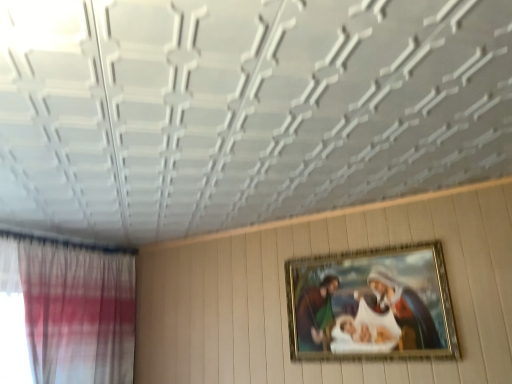
This screenshot has height=384, width=512. What do you see at coordinates (371, 304) in the screenshot?
I see `gold-framed painting at center` at bounding box center [371, 304].

Where is `gold-framed painting at center`? The width and height of the screenshot is (512, 384). gold-framed painting at center is located at coordinates (371, 304).

You are a GUI agent. You are given a task and a screenshot of the screen. Output one action in this format:
    pyautogui.click(x=<x>, y=<y>)
    Task: Click on the gold-framed painting at center
    
    Given the screenshot: What is the action you would take?
    pyautogui.click(x=371, y=304)